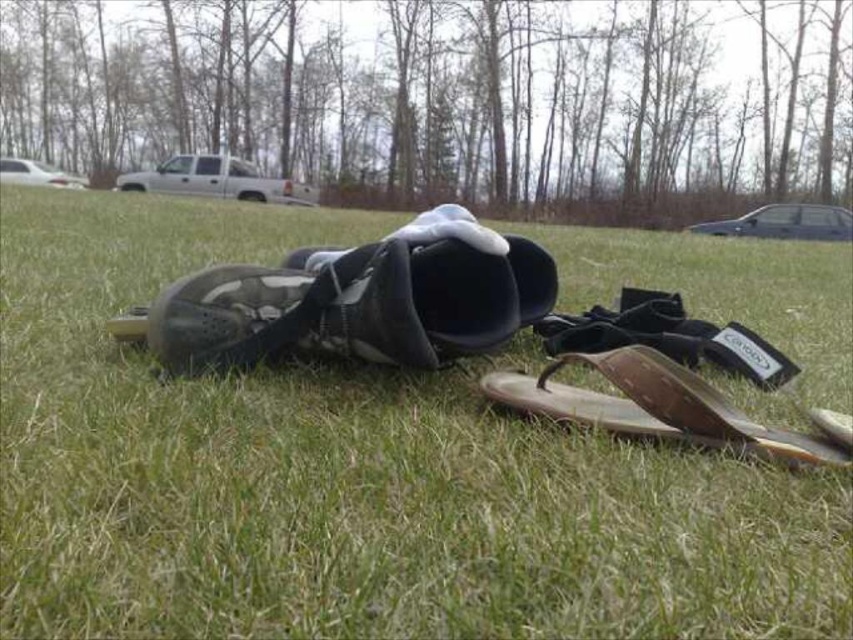
Is brown leather flip-flop at lower right bigger than white matte truck at upper center?

No.

Can you confirm if brown leather flip-flop at lower right is positioned above white matte truck at upper center?

No.

Which is in front, point (630, 355) or point (120, 180)?

Point (630, 355) is more forward.

This screenshot has height=640, width=853. I want to click on brown leather flip-flop at lower right, so click(x=659, y=406).

Does matte black shoe at center appear on the right side of white glossy car at upper left?

Indeed, matte black shoe at center is positioned on the right side of white glossy car at upper left.

Can you confirm if matte black shoe at center is thinner than white glossy car at upper left?

Indeed, matte black shoe at center has a lesser width compared to white glossy car at upper left.

Between point (317, 304) and point (16, 180), which one is positioned in front?

Point (317, 304) is more forward.

Where is `matte black shoe at center`? The image size is (853, 640). matte black shoe at center is located at coordinates (357, 307).

Is the position of matte black roller skate at center more distant than that of white glossy car at upper left?

No, it is in front of white glossy car at upper left.

Who is more distant from viewer, (30,394) or (16,168)?

Positioned behind is point (16,168).

The width and height of the screenshot is (853, 640). Identify the location of matte black roller skate at center. (346, 476).